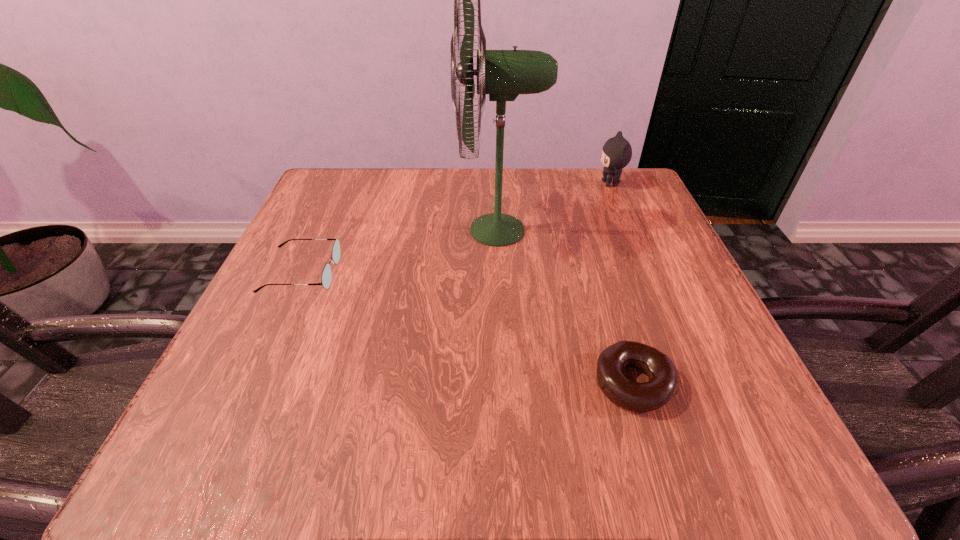
In order to click on free space located on the front-facing side of the rightmost object in this screenshot , I will do `click(470, 184)`.

Identify the location of vacant space located 0.310m on the front-facing side of the rightmost object. The height and width of the screenshot is (540, 960). (466, 184).

The image size is (960, 540). In order to click on vacant region located 0.380m on the front-facing side of the rightmost object in this screenshot , I will do `click(437, 184)`.

Where is `vacant space located 0.360m on the lenses of the leftmost object`? The width and height of the screenshot is (960, 540). vacant space located 0.360m on the lenses of the leftmost object is located at coordinates (532, 273).

Where is `vacant space located 0.130m on the left of the doughnut`? vacant space located 0.130m on the left of the doughnut is located at coordinates (503, 383).

I want to click on fan that is at the far edge, so pos(503,74).

The image size is (960, 540). What are the coordinates of `kitten that is at the far edge` in the screenshot? It's located at (616, 153).

You are a GUI agent. You are given a task and a screenshot of the screen. Output one action in this format:
    pyautogui.click(x=<x>, y=<y>)
    Task: Click on the object present at the near edge
    The height and width of the screenshot is (540, 960).
    Given the screenshot: What is the action you would take?
    pyautogui.click(x=663, y=384)

Where is `object that is at the left edge`? object that is at the left edge is located at coordinates (326, 274).

Identify the location of kitten that is at the right edge. This screenshot has width=960, height=540. pyautogui.click(x=616, y=153).